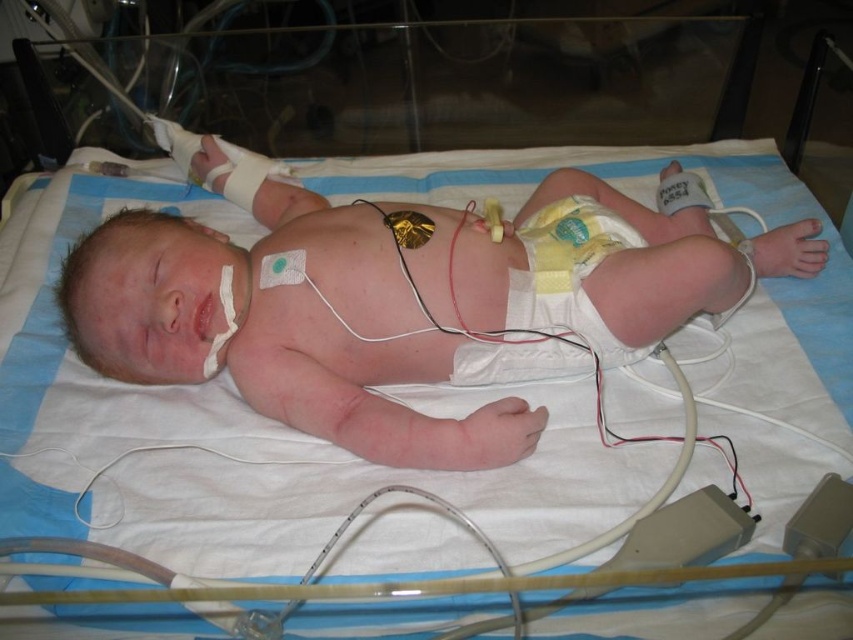
Question: Which object is farther from the camera taking this photo?

Choices:
 (A) pink smooth skin at center
 (B) yellow cloth diaper at center

Answer: (B)

Question: Is pink smooth skin at center above yellow cloth diaper at center?

Choices:
 (A) no
 (B) yes

Answer: (B)

Question: Is pink smooth skin at center to the left of yellow cloth diaper at center from the viewer's perspective?

Choices:
 (A) yes
 (B) no

Answer: (A)

Question: Does pink smooth skin at center appear on the right side of yellow cloth diaper at center?

Choices:
 (A) yes
 (B) no

Answer: (B)